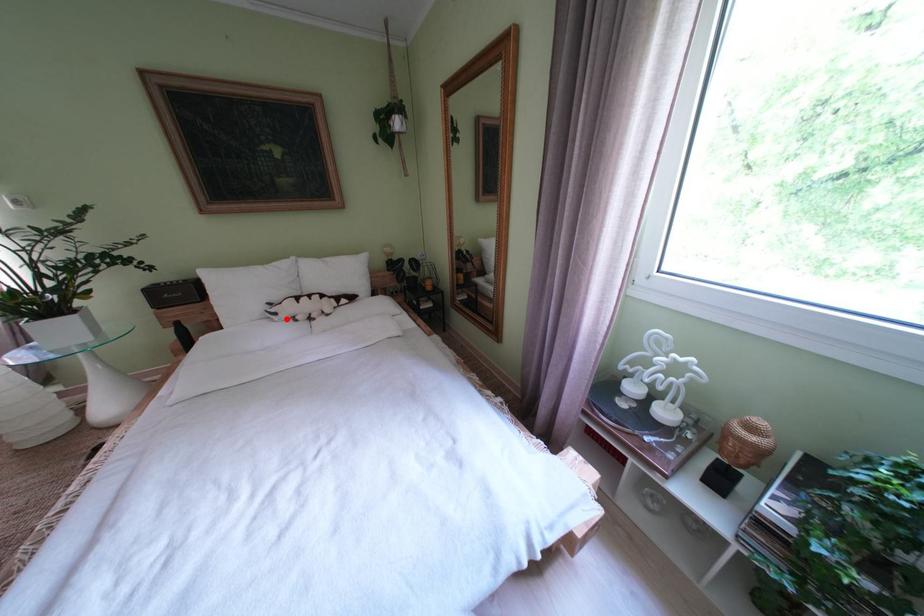
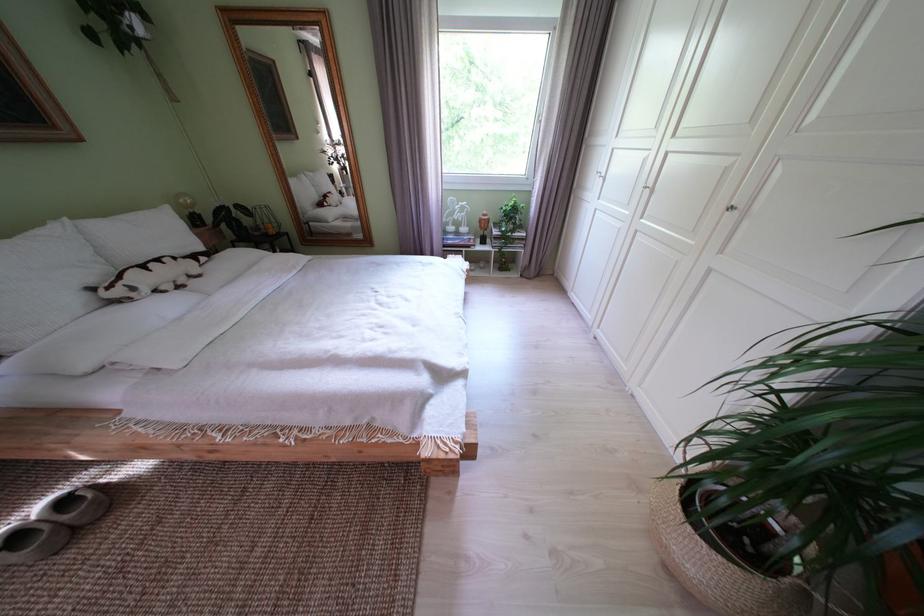
Question: I am providing you with two images of the same scene from different viewpoints. Given a red point in image1, look at the same physical point in image2. Is it:

Choices:
 (A) Closer to the viewpoint
 (B) Farther from the viewpoint

Answer: (B)